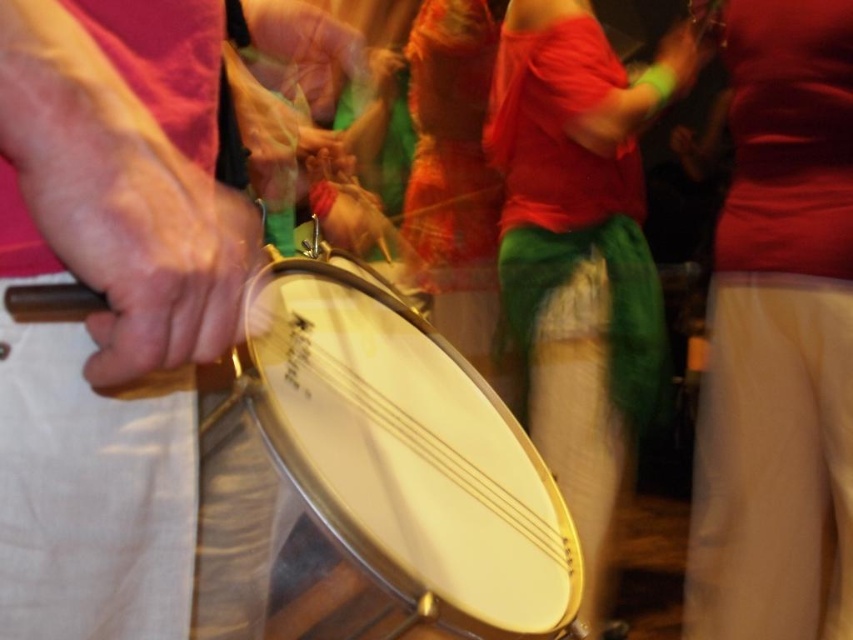
Who is positioned more to the left, matte black drumstick at left or matte green scarf at upper center?

matte black drumstick at left

Which is in front, point (254, 211) or point (671, 28)?

Positioned in front is point (254, 211).

Describe the element at coordinates (138, 241) in the screenshot. This screenshot has width=853, height=640. I see `matte black drumstick at left` at that location.

You are a GUI agent. You are given a task and a screenshot of the screen. Output one action in this format:
    pyautogui.click(x=<x>, y=<y>)
    Task: Click on the matte black drumstick at left
    Image resolution: width=853 pixels, height=640 pixels.
    Given the screenshot: What is the action you would take?
    pyautogui.click(x=138, y=241)

Which is more to the right, metallic drum at center or matte green scarf at upper center?

matte green scarf at upper center is more to the right.

Is metallic drum at center smaller than matte green scarf at upper center?

No, metallic drum at center is not smaller than matte green scarf at upper center.

Is point (560, 596) in front of point (677, 40)?

Yes.

You are a GUI agent. You are given a task and a screenshot of the screen. Output one action in this format:
    pyautogui.click(x=<x>, y=<y>)
    Task: Click on the metallic drum at center
    Image resolution: width=853 pixels, height=640 pixels.
    Given the screenshot: What is the action you would take?
    pyautogui.click(x=408, y=451)

Does metallic drum at center lie behind matte black drumstick at left?

Yes, it is behind matte black drumstick at left.

Can you confirm if metallic drum at center is wider than matte black drumstick at left?

Indeed, metallic drum at center has a greater width compared to matte black drumstick at left.

Where is `metallic drum at center`? The image size is (853, 640). metallic drum at center is located at coordinates click(408, 451).

The image size is (853, 640). I want to click on metallic drum at center, so click(x=408, y=451).